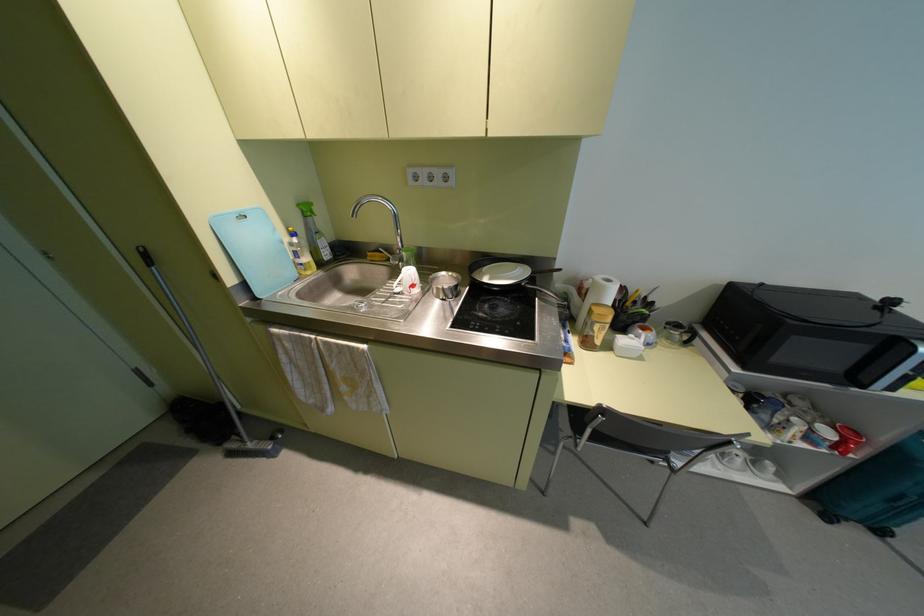
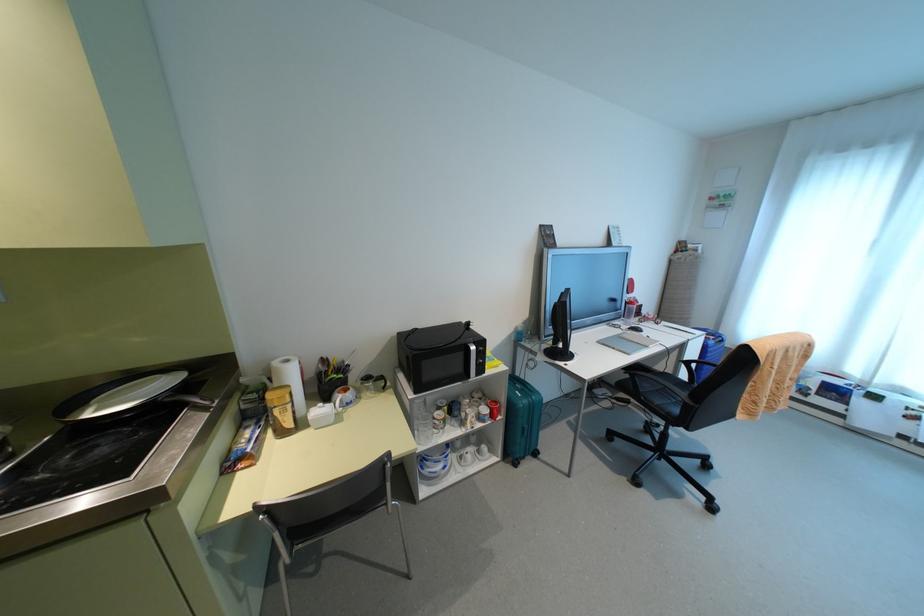
Where in the second image is the point corresponding to (880,531) from the first image?

(535, 454)